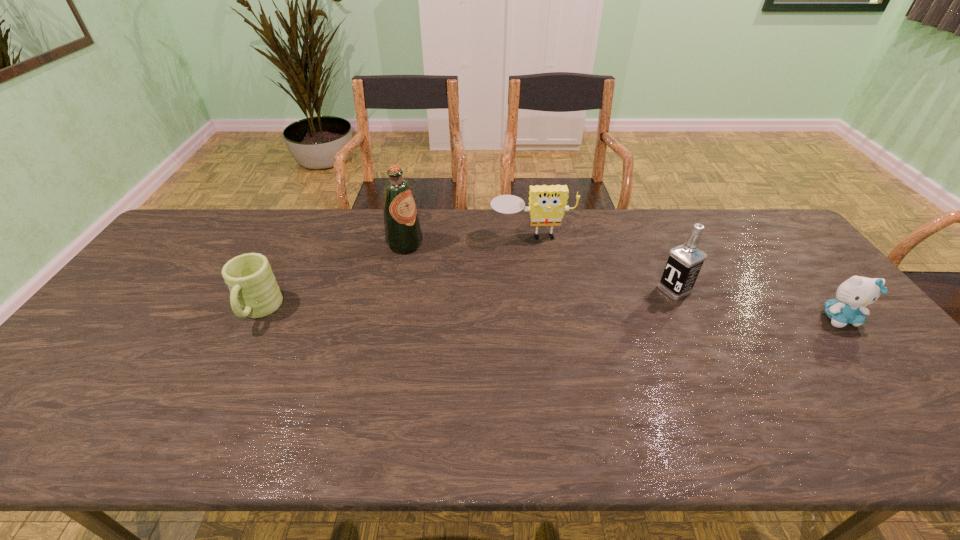
I want to click on the leftmost object, so click(255, 293).

Find the location of a particular element. This screenshot has width=960, height=540. kitten is located at coordinates (854, 294).

Image resolution: width=960 pixels, height=540 pixels. Identify the location of the third object from left to right. [x=547, y=204].

Where is `sponge`? sponge is located at coordinates (547, 204).

Identify the location of vodka. (685, 261).

Find the location of a particular element. The width and height of the screenshot is (960, 540). the second tallest object is located at coordinates (685, 261).

Locate an element on the screen. Image resolution: width=960 pixels, height=540 pixels. the fourth object from right to left is located at coordinates (403, 234).

Identify the location of olive oil. The height and width of the screenshot is (540, 960). (403, 234).

Image resolution: width=960 pixels, height=540 pixels. What are the coordinates of `vacant position located 0.150m on the side of the mug with the handle` in the screenshot? It's located at (222, 382).

Identify the location of vacant space located on the face of the rightmost object. This screenshot has height=540, width=960. (872, 358).